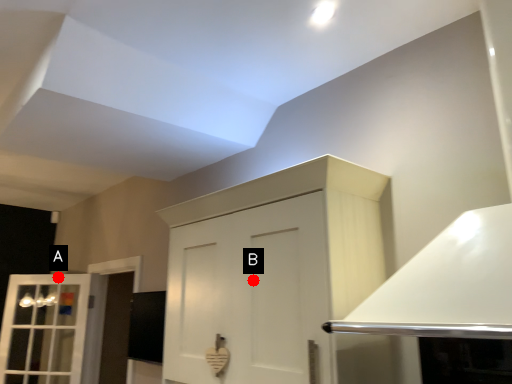
Question: Two points are circled on the image, labeled by A and B beside each circle. Which of the following is the closest to the observer?

Choices:
 (A) A is closer
 (B) B is closer

Answer: (B)